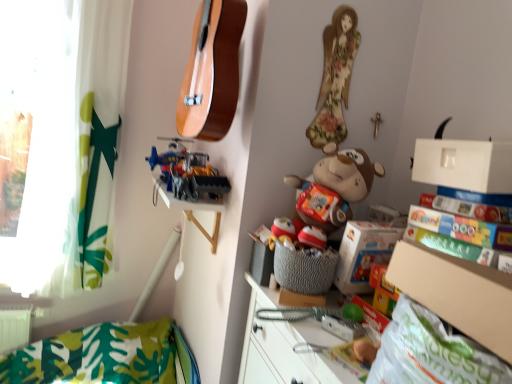
Question: In terms of height, does white matte box at upper right look taller or shorter compared to natural wood guitar at upper center?

Choices:
 (A) short
 (B) tall

Answer: (A)

Question: From a real-world perspective, is white matte box at upper right above or below natural wood guitar at upper center?

Choices:
 (A) below
 (B) above

Answer: (A)

Question: Which is farther from the transparent plastic window screen at upper left?

Choices:
 (A) metallic plastic toy at upper center, which appears as the 2th toy when viewed from the front
 (B) floral fabric doll at upper right
 (C) white matte box at upper right
 (D) brown plush monkey at center, the first toy positioned from the front
 (E) multicolored cardboard book at right

Answer: (E)

Question: Based on their relative distances, which object is farther from the transparent plastic window screen at upper left?

Choices:
 (A) floral fabric doll at upper right
 (B) cardboard box at lower right
 (C) natural wood guitar at upper center
 (D) green fabric curtain at left
 (E) brown plush monkey at center, the 2th toy from the left

Answer: (B)